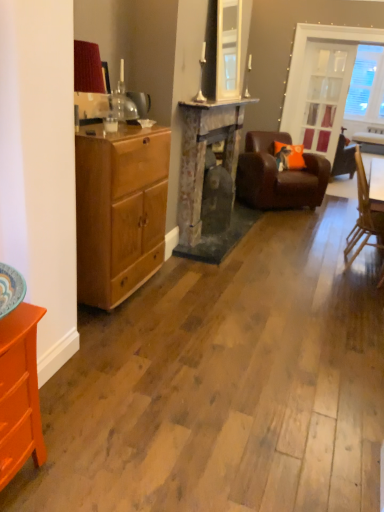
Where is `vacant space to the right of orange painted wood dresser at lower left`? The image size is (384, 512). vacant space to the right of orange painted wood dresser at lower left is located at coordinates (94, 470).